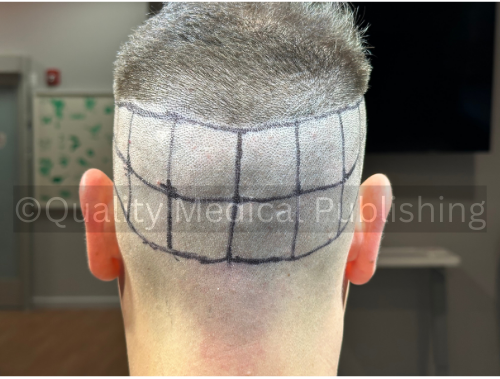
Where is `wall`? wall is located at coordinates (x=77, y=49).